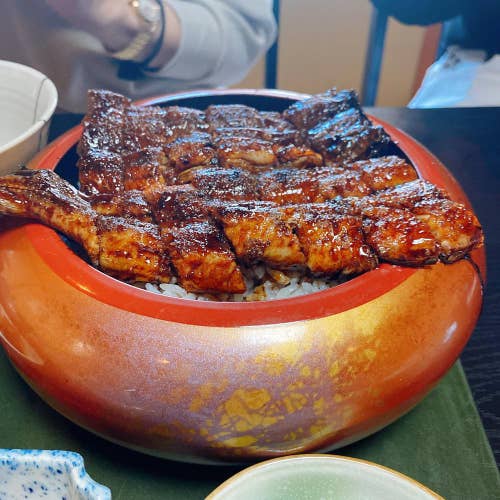
Where is `white bowl on left`? white bowl on left is located at coordinates (16, 102).